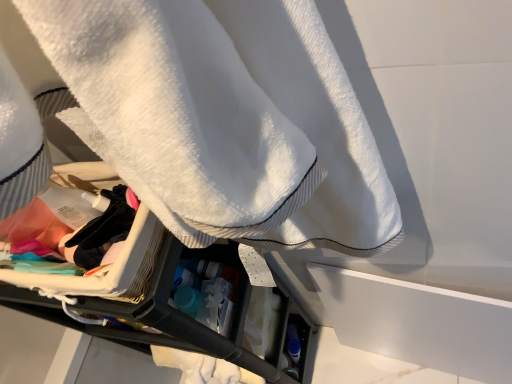
Question: Can you confirm if white terry cloth towel at upper center is wider than black fabric at center?

Choices:
 (A) yes
 (B) no

Answer: (A)

Question: From the image's perspective, is white terry cloth towel at upper center located above black fabric at center?

Choices:
 (A) yes
 (B) no

Answer: (A)

Question: Is white terry cloth towel at upper center in front of black fabric at center?

Choices:
 (A) yes
 (B) no

Answer: (A)

Question: Does white terry cloth towel at upper center have a greater height compared to black fabric at center?

Choices:
 (A) no
 (B) yes

Answer: (B)

Question: Would you say white terry cloth towel at upper center is a long distance from black fabric at center?

Choices:
 (A) no
 (B) yes

Answer: (A)

Question: Does white terry cloth towel at upper center touch black fabric at center?

Choices:
 (A) yes
 (B) no

Answer: (B)

Question: Is white terry cloth towel at upper center inside black fabric at center?

Choices:
 (A) yes
 (B) no

Answer: (B)

Question: Considering the relative positions of black fabric at center and white terry cloth towel at upper center in the image provided, is black fabric at center behind white terry cloth towel at upper center?

Choices:
 (A) no
 (B) yes

Answer: (B)

Question: Does black fabric at center have a larger size compared to white terry cloth towel at upper center?

Choices:
 (A) no
 (B) yes

Answer: (A)

Question: Could you tell me if black fabric at center is turned towards white terry cloth towel at upper center?

Choices:
 (A) no
 (B) yes

Answer: (B)

Question: Can you confirm if black fabric at center is shorter than white terry cloth towel at upper center?

Choices:
 (A) no
 (B) yes

Answer: (B)

Question: Does black fabric at center have a lesser width compared to white terry cloth towel at upper center?

Choices:
 (A) no
 (B) yes

Answer: (B)

Question: From the image's perspective, is white terry cloth towel at upper center located above or below black fabric at center?

Choices:
 (A) below
 (B) above

Answer: (B)